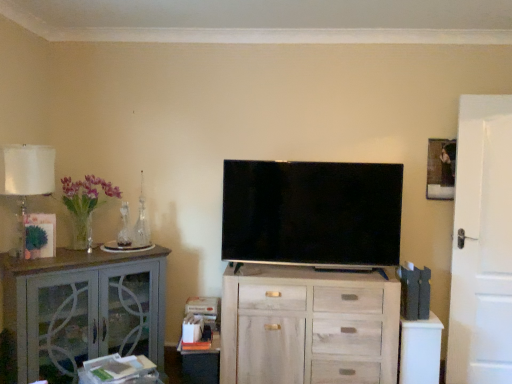
Question: Considering the relative positions of translucent glass table lamp at left and translucent glass vase at left in the image provided, is translucent glass table lamp at left to the left of translucent glass vase at left from the viewer's perspective?

Choices:
 (A) yes
 (B) no

Answer: (A)

Question: Is translucent glass vase at left surrounded by translucent glass table lamp at left?

Choices:
 (A) no
 (B) yes

Answer: (A)

Question: Does translucent glass table lamp at left have a smaller size compared to translucent glass vase at left?

Choices:
 (A) no
 (B) yes

Answer: (B)

Question: Does translucent glass table lamp at left have a greater width compared to translucent glass vase at left?

Choices:
 (A) no
 (B) yes

Answer: (A)

Question: Can you confirm if translucent glass table lamp at left is taller than translucent glass vase at left?

Choices:
 (A) yes
 (B) no

Answer: (A)

Question: Is translucent glass table lamp at left taller or shorter than translucent glass vase at left?

Choices:
 (A) tall
 (B) short

Answer: (A)

Question: From the image's perspective, is translucent glass table lamp at left located above or below translucent glass vase at left?

Choices:
 (A) below
 (B) above

Answer: (B)

Question: In the image, is translucent glass table lamp at left positioned in front of or behind translucent glass vase at left?

Choices:
 (A) behind
 (B) front

Answer: (B)

Question: Visually, is translucent glass table lamp at left positioned to the left or to the right of translucent glass vase at left?

Choices:
 (A) left
 (B) right

Answer: (A)

Question: Considering the positions of matte black tv at center and white matte door at right in the image, is matte black tv at center wider or thinner than white matte door at right?

Choices:
 (A) wide
 (B) thin

Answer: (A)

Question: Is point (284, 168) positioned closer to the camera than point (471, 352)?

Choices:
 (A) farther
 (B) closer

Answer: (B)

Question: Is matte black tv at center in front of or behind white matte door at right in the image?

Choices:
 (A) front
 (B) behind

Answer: (A)

Question: Is matte black tv at center inside the boundaries of white matte door at right, or outside?

Choices:
 (A) inside
 (B) outside

Answer: (B)

Question: From a real-world perspective, relative to translucent glass vase at left, is white matte door at right vertically above or below?

Choices:
 (A) above
 (B) below

Answer: (B)

Question: Does point (467, 145) appear closer or farther from the camera than point (93, 190)?

Choices:
 (A) farther
 (B) closer

Answer: (A)